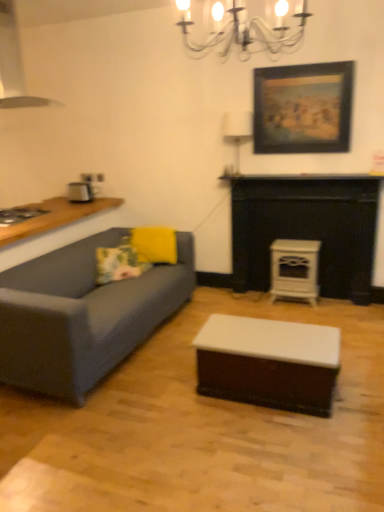
Locate an element on the screen. blank space above white glossy coffee table at center (from a real-world perspective) is located at coordinates (278, 331).